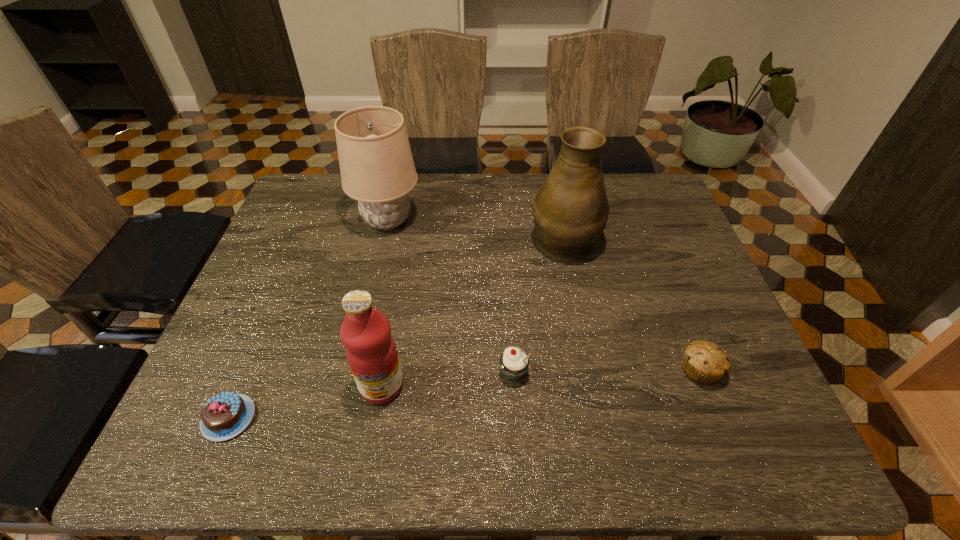
This screenshot has width=960, height=540. I want to click on object at the left edge, so click(224, 416).

Find the location of `object that is at the right edge`. object that is at the right edge is located at coordinates tap(704, 362).

You are a GUI agent. You are given a task and a screenshot of the screen. Output one action in this format:
    pyautogui.click(x=<x>, y=<y>)
    Task: Click on the object that is at the near left corner
    The height and width of the screenshot is (540, 960).
    Given the screenshot: What is the action you would take?
    pyautogui.click(x=224, y=416)

The height and width of the screenshot is (540, 960). I want to click on free space at the far edge of the desktop, so 488,183.

In the image, there is a desktop. Where is `vacant region at the near edge`? The width and height of the screenshot is (960, 540). vacant region at the near edge is located at coordinates (316, 447).

Identify the location of vacant space at the left edge of the desktop. The image size is (960, 540). (229, 363).

In the image, there is a desktop. At what (x,y) coordinates should I click in order to perform the action: click on free space at the right edge. Please return your answer as a coordinate pair (x, y). The width and height of the screenshot is (960, 540). Looking at the image, I should click on (639, 232).

Where is `free space at the near left corner`? This screenshot has height=540, width=960. free space at the near left corner is located at coordinates (177, 441).

The image size is (960, 540). Find the location of `vacant space at the far right corner of the desktop`. vacant space at the far right corner of the desktop is located at coordinates (632, 194).

Where is `unoccupied position between the second object from right to left and the third object from right to left`? This screenshot has height=540, width=960. unoccupied position between the second object from right to left and the third object from right to left is located at coordinates (539, 306).